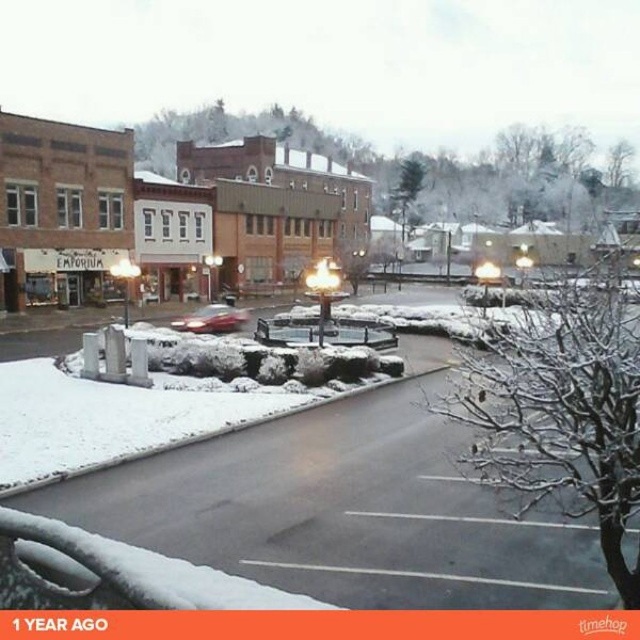
Question: Which point is closer to the camera?

Choices:
 (A) white fluffy snow at center
 (B) brick building at center

Answer: (A)

Question: Can you confirm if brick building at center is bigger than white fluffy snow at center?

Choices:
 (A) no
 (B) yes

Answer: (B)

Question: From the image, what is the correct spatial relationship of brick building at center in relation to shiny red car at center?

Choices:
 (A) below
 (B) above

Answer: (B)

Question: Which of these objects is positioned farthest from the white fluffy snow at center?

Choices:
 (A) shiny red car at center
 (B) brick building at center

Answer: (B)

Question: From the image, what is the correct spatial relationship of brick building at center in relation to shiny red car at center?

Choices:
 (A) left
 (B) right

Answer: (A)

Question: Among these points, which one is nearest to the camera?

Choices:
 (A) coord(216,230)
 (B) coord(237,328)

Answer: (B)